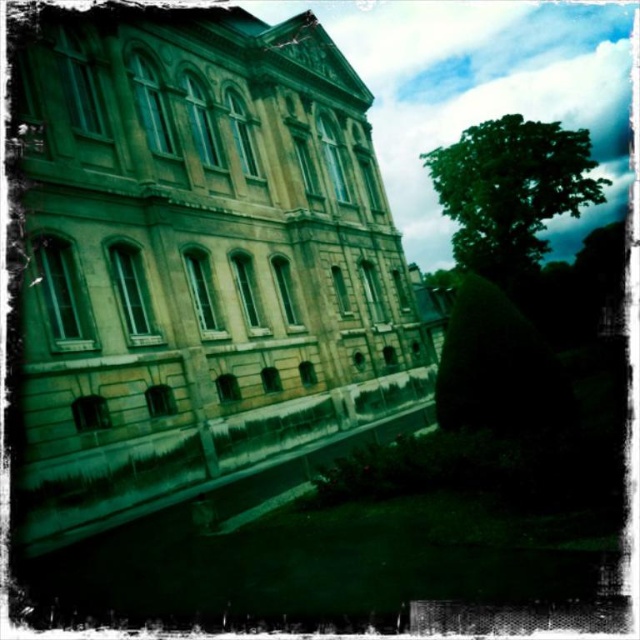
Question: Which object is farther from the camera taking this photo?

Choices:
 (A) stone building at center
 (B) green leafy tree at upper right

Answer: (B)

Question: Is stone building at center wider than green leafy tree at upper right?

Choices:
 (A) no
 (B) yes

Answer: (A)

Question: Observing the image, what is the correct spatial positioning of stone building at center in reference to green leafy tree at upper right?

Choices:
 (A) above
 (B) below

Answer: (B)

Question: Can you confirm if stone building at center is thinner than green leafy tree at upper right?

Choices:
 (A) no
 (B) yes

Answer: (B)